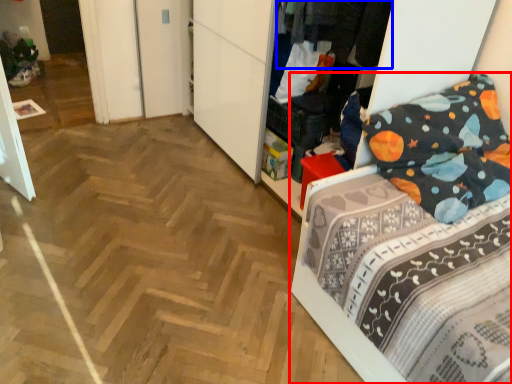
Question: Which object is closer to the camera taking this photo, bed (highlighted by a red box) or clothing (highlighted by a blue box)?

Choices:
 (A) bed
 (B) clothing

Answer: (A)